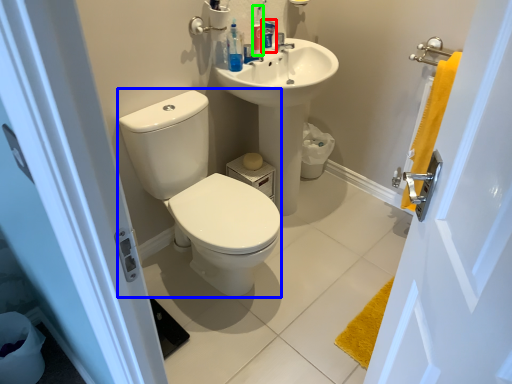
Question: Estimate the real-world distances between objects in this image. Which object is farther from mouthwash (highlighted by a red box), sit (highlighted by a blue box) or toiletry (highlighted by a green box)?

Choices:
 (A) sit
 (B) toiletry

Answer: (A)